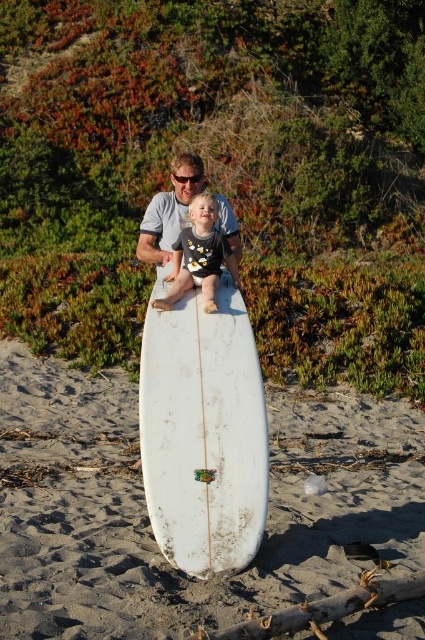
Can you confirm if white sand at center is wider than white matte surfboard at center?

Yes, white sand at center is wider than white matte surfboard at center.

Which is in front, point (8, 456) or point (149, 339)?

Positioned in front is point (149, 339).

Between point (291, 547) and point (142, 451), which one is positioned behind?

The point (291, 547) is more distant.

Identify the location of white sand at center. This screenshot has width=425, height=640. (147, 513).

Is white sand at center below matte gray shirt at center?

Correct, white sand at center is located below matte gray shirt at center.

Image resolution: width=425 pixels, height=640 pixels. What are the coordinates of `white sand at center` in the screenshot? It's located at (147, 513).

At what (x,y) coordinates should I click in order to perform the action: click on white sand at center. Please return your answer as a coordinate pair (x, y). Looking at the image, I should click on (x=147, y=513).

I want to click on white sand at center, so click(147, 513).

Between white matte surfboard at center and matte gray shirt at center, which one is positioned higher?

matte gray shirt at center

Can you confirm if white matte surfboard at center is positioned to the left of matte gray shirt at center?

No, white matte surfboard at center is not to the left of matte gray shirt at center.

Describe the element at coordinates (204, 433) in the screenshot. I see `white matte surfboard at center` at that location.

The height and width of the screenshot is (640, 425). Identify the location of white matte surfboard at center. (204, 433).